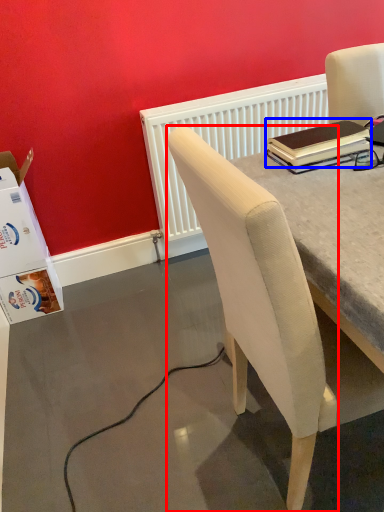
Question: Which point is closer to the camera, chair (highlighted by a red box) or notebook (highlighted by a blue box)?

Choices:
 (A) chair
 (B) notebook

Answer: (A)